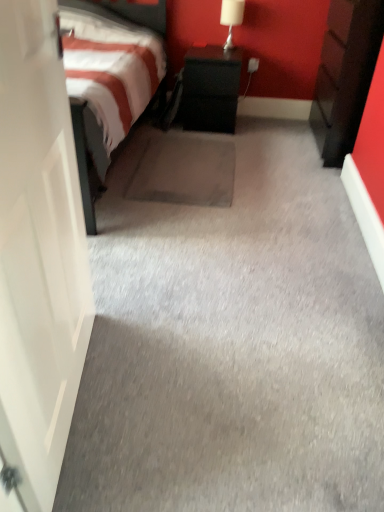
Where is `free space on the front side of black matte nightstand at center, the 1th nightstand in the left-to-right sequence`? Image resolution: width=384 pixels, height=512 pixels. free space on the front side of black matte nightstand at center, the 1th nightstand in the left-to-right sequence is located at coordinates (190, 141).